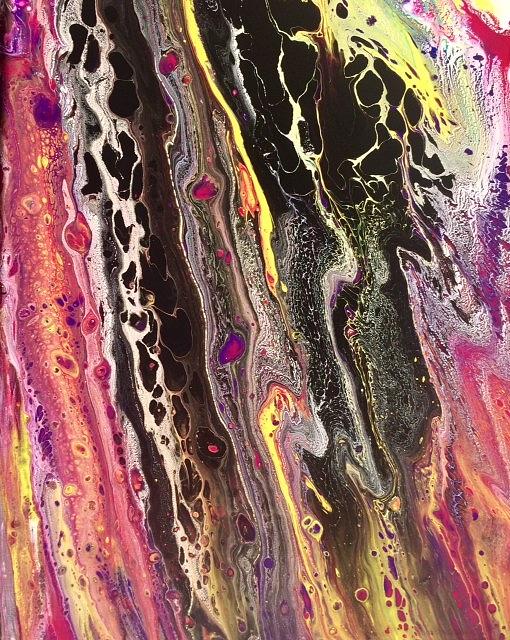
Where is `white paint`? The width and height of the screenshot is (510, 640). white paint is located at coordinates (157, 433), (144, 396), (134, 305), (384, 112), (294, 130).